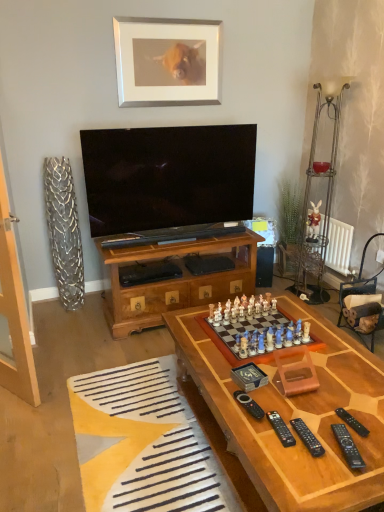
At what (x,y) coordinates should I click in order to perform the action: click on free location to the right of black plastic remote at lower right, the 4th remote in the right-to-left sequence. Please return your answer as a coordinate pair (x, y). The height and width of the screenshot is (512, 384). Looking at the image, I should click on (324, 426).